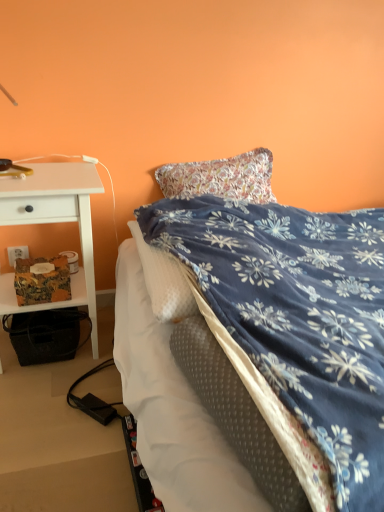
Where is `free point above white wood desk at left (from a real-world perspective)`? free point above white wood desk at left (from a real-world perspective) is located at coordinates coord(41,172).